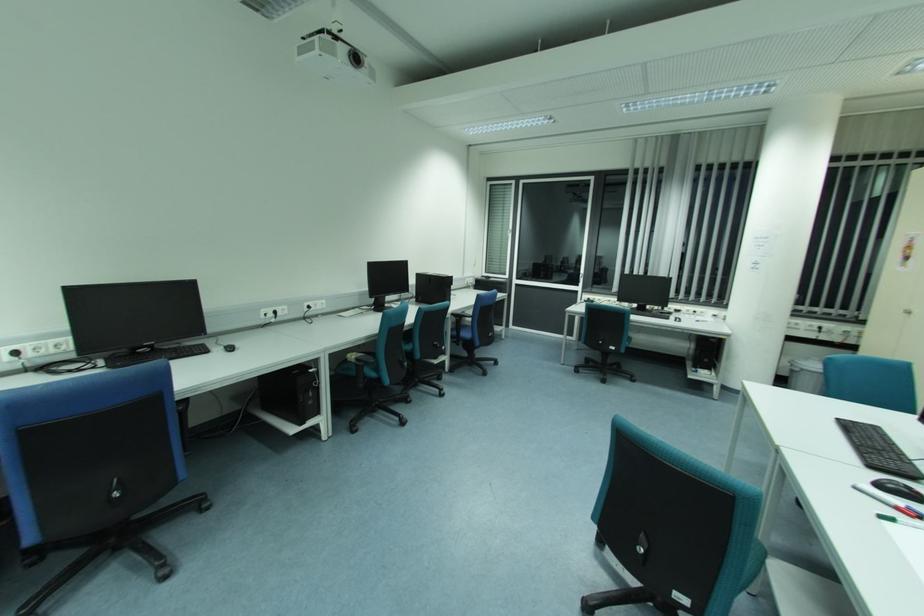
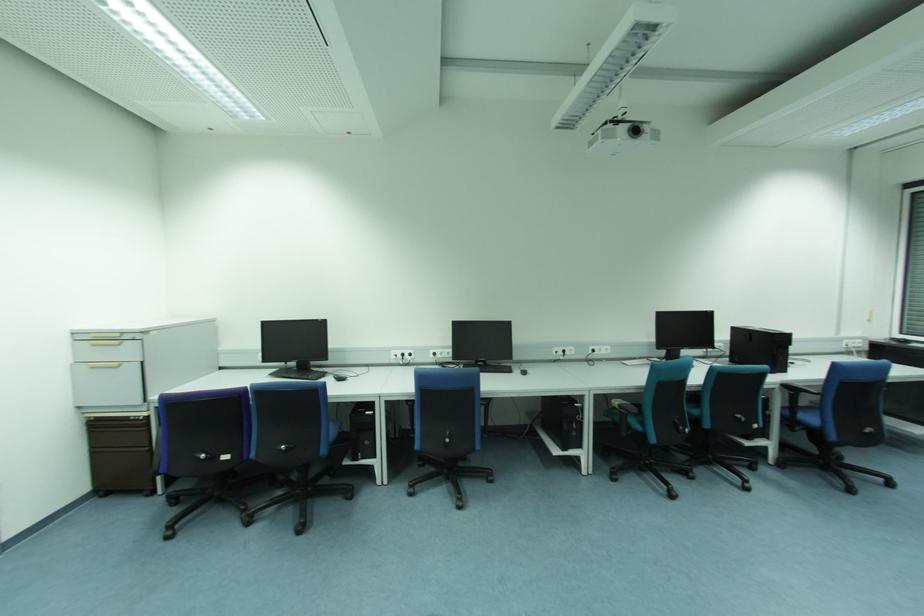
Question: The images are taken continuously from a first-person perspective. In which direction is your viewpoint rotating?

Choices:
 (A) Left
 (B) Right
 (C) Up
 (D) Down

Answer: (A)